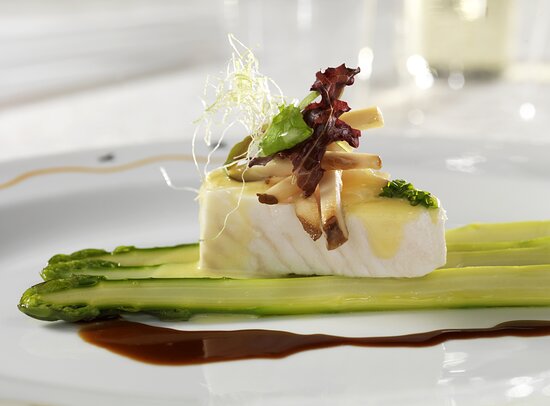
Find the location of a particular element. cup is located at coordinates (473, 36).